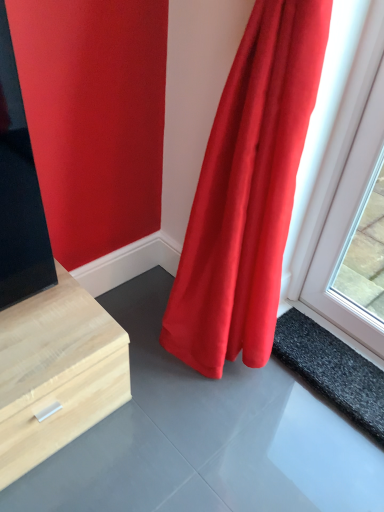
Find the location of a particular element. Image resolution: width=384 pixels, height=512 pixels. free space above black rubber mat at lower right (from a real-world perspective) is located at coordinates (344, 358).